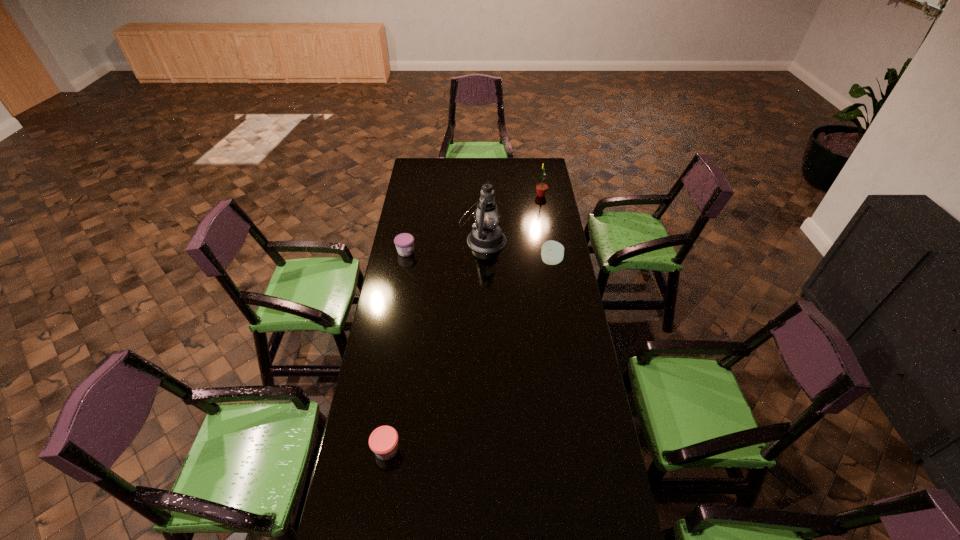
Find the location of a particular element. The image size is (960, 540). vacant space located 0.300m on the face of the sunflower is located at coordinates 483,195.

Identify the location of blank space located 0.280m on the left of the third tallest object. (483, 261).

Find the location of `vacant space located on the front label of the farther jam`. vacant space located on the front label of the farther jam is located at coordinates pos(466,252).

Where is `vacant space located 0.300m on the front label of the nearer jam`? vacant space located 0.300m on the front label of the nearer jam is located at coordinates tap(490, 449).

I want to click on sunflower that is at the right edge, so click(x=541, y=188).

Where is `apple that is at the right edge`? The width and height of the screenshot is (960, 540). apple that is at the right edge is located at coordinates pyautogui.click(x=552, y=252).

This screenshot has width=960, height=540. In the image, there is a desktop. Find the location of `free space at the far edge`. free space at the far edge is located at coordinates (468, 160).

In the image, there is a desktop. Where is `free region at the left edge`? The image size is (960, 540). free region at the left edge is located at coordinates (351, 492).

In the image, there is a desktop. Identify the location of vacant space at the right edge. (553, 348).

In the image, there is a desktop. Where is `vacant space at the far left corner`? vacant space at the far left corner is located at coordinates (411, 175).